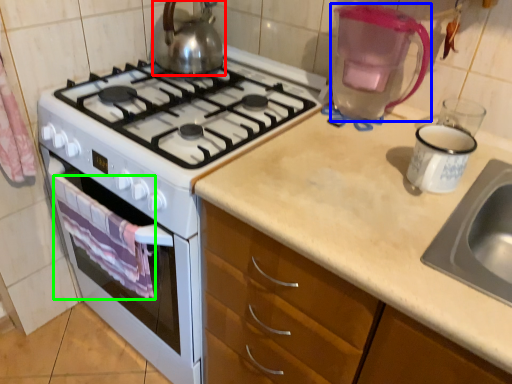
Question: Which object is positioned closest to kettle (highlighted by a red box)? Select from coffeepot (highlighted by a blue box) and cloth (highlighted by a green box).

Choices:
 (A) coffeepot
 (B) cloth

Answer: (A)